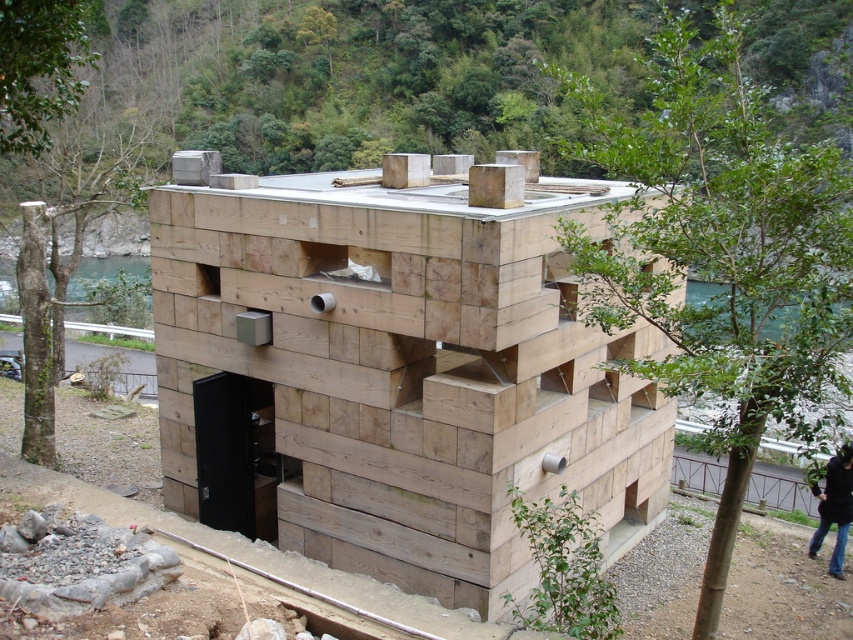
Question: Can you confirm if natural wood house at center is bigger than jeans at lower right?

Choices:
 (A) no
 (B) yes

Answer: (B)

Question: Which point appears farthest from the camera in this image?

Choices:
 (A) (811, 545)
 (B) (605, 356)

Answer: (A)

Question: Where is natural wood house at center located in relation to jeans at lower right in the image?

Choices:
 (A) below
 (B) above

Answer: (B)

Question: Does natural wood house at center come in front of jeans at lower right?

Choices:
 (A) yes
 (B) no

Answer: (A)